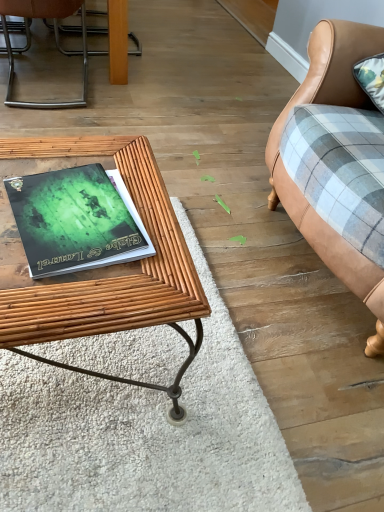
You are a GUI agent. You are given a task and a screenshot of the screen. Output one action in this format:
    pyautogui.click(x=<x>, y=<y>)
    Task: Click on the vacant space to the right of metallic silver chair at upper left
    Image resolution: width=384 pixels, height=512 pixels.
    Given the screenshot: What is the action you would take?
    pyautogui.click(x=150, y=101)